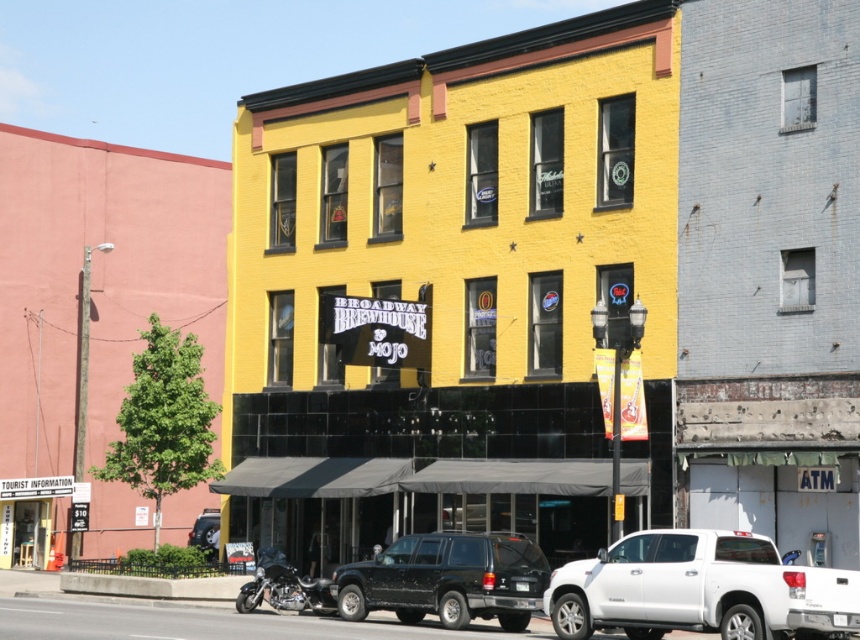
In the scene shown: You are standing on the sidewalk in front of the yellow building with black accents. You notice two points marked on the ground. The first point is at coordinate point(768, 632) and the second point is at point(195, 531). Which point is closer to you?

Point(768, 632) is in front of point(195, 531), so it is closer to you.

You are a delivery person trying to park your metallic silver motorcycle at lower left near the black matte suv at center. Can you park the motorcycle directly in front of the suv?

The black matte suv at center is located above the metallic silver motorcycle at lower left, so the motorcycle is already positioned below the SUV. Since the SUV is above the motorcycle, parking the motorcycle directly in front would require space in front of the SUV, but their vertical positioning doesn